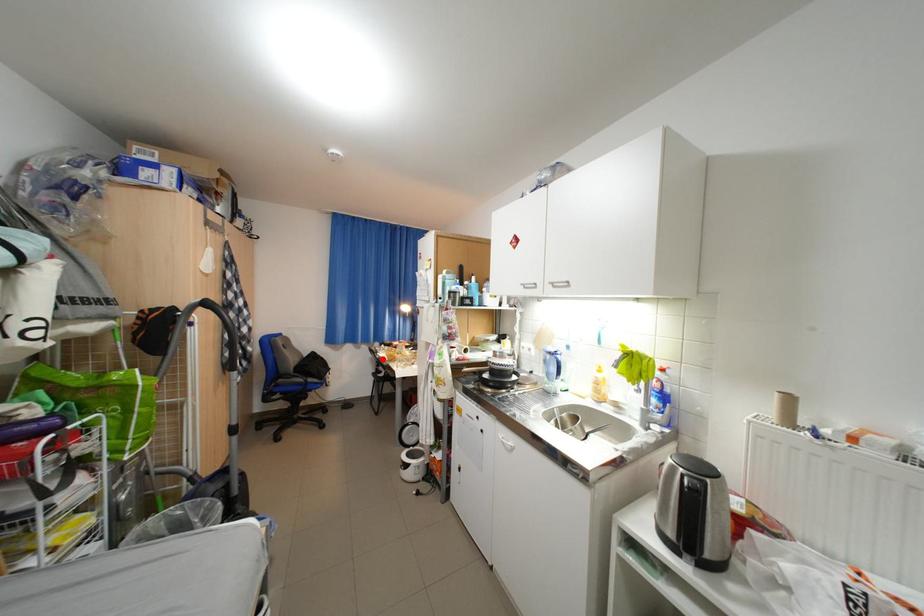
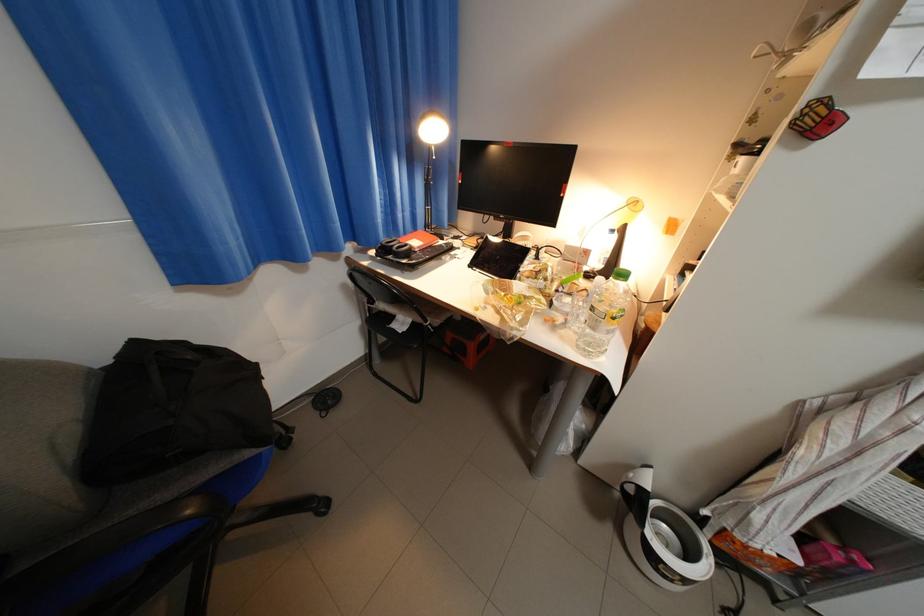
Question: I am providing you with two images of the same scene from different viewpoints. Image1 has a red point marked. In image2, the corresponding 3D location appears at what relative position? Reply with the corresponding letter.

Choices:
 (A) Closer
 (B) Farther

Answer: (A)